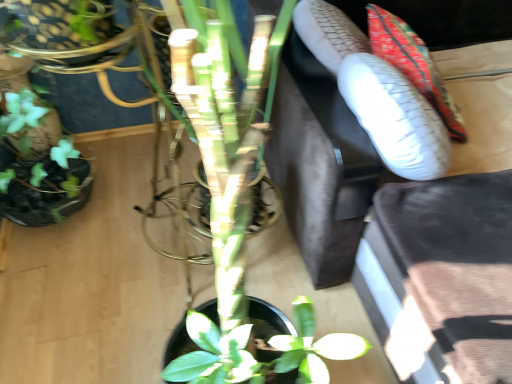
Question: From the image's perspective, relative to textured fabric cushion at upper right, is velvet dark brown couch at upper right above or below?

Choices:
 (A) above
 (B) below

Answer: (B)

Question: From a real-world perspective, relative to textured fabric cushion at upper right, is velvet dark brown couch at upper right vertically above or below?

Choices:
 (A) below
 (B) above

Answer: (A)

Question: Is velvet dark brown couch at upper right spatially inside textured fabric cushion at upper right, or outside of it?

Choices:
 (A) outside
 (B) inside

Answer: (A)

Question: Based on their positions, is textured fabric cushion at upper right located to the left or right of velvet dark brown couch at upper right?

Choices:
 (A) right
 (B) left

Answer: (B)

Question: Does point pyautogui.click(x=442, y=89) appear closer or farther from the camera than point pyautogui.click(x=280, y=142)?

Choices:
 (A) closer
 (B) farther

Answer: (A)

Question: Is textured fabric cushion at upper right bigger or smaller than velvet dark brown couch at upper right?

Choices:
 (A) small
 (B) big

Answer: (A)

Question: From the image's perspective, is textured fabric cushion at upper right located above or below velvet dark brown couch at upper right?

Choices:
 (A) below
 (B) above

Answer: (B)